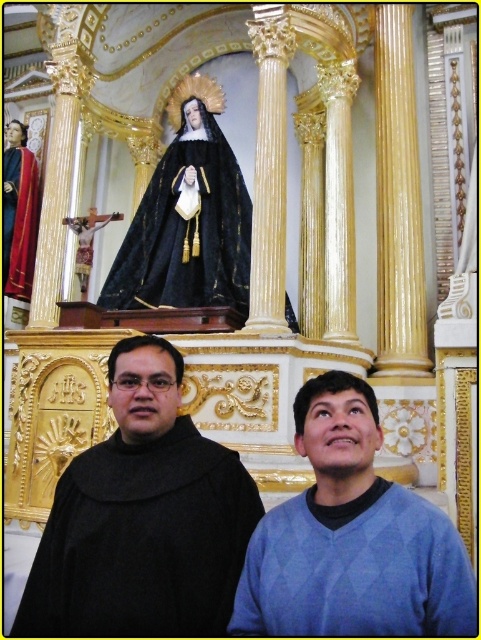
Question: Does black matte robe at center appear over velvet red robe at left?

Choices:
 (A) yes
 (B) no

Answer: (B)

Question: Among these points, which one is nearest to the camera?

Choices:
 (A) (133, 420)
 (B) (169, 268)
 (C) (399, 536)

Answer: (C)

Question: Which point is farther to the camera?

Choices:
 (A) blue sweater at lower right
 (B) velvet red robe at left
 (C) black velvet robe at upper center

Answer: (B)

Question: Can you confirm if blue sweater at lower right is positioned above black velvet robe at upper center?

Choices:
 (A) yes
 (B) no

Answer: (B)

Question: Does blue sweater at lower right have a lesser width compared to black velvet robe at upper center?

Choices:
 (A) yes
 (B) no

Answer: (A)

Question: Among these objects, which one is nearest to the camera?

Choices:
 (A) blue sweater at lower right
 (B) black matte robe at center
 (C) velvet red robe at left
 (D) black velvet robe at upper center

Answer: (A)